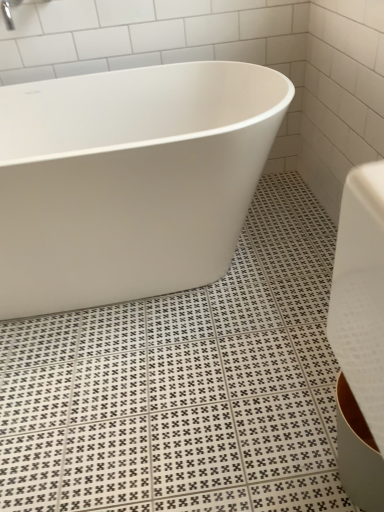
Question: Would you say white glossy bathtub at center contains silver metallic faucet at upper left?

Choices:
 (A) yes
 (B) no

Answer: (B)

Question: Can you confirm if white glossy bathtub at center is thinner than silver metallic faucet at upper left?

Choices:
 (A) no
 (B) yes

Answer: (A)

Question: Considering the relative sizes of white glossy bathtub at center and silver metallic faucet at upper left in the image provided, is white glossy bathtub at center taller than silver metallic faucet at upper left?

Choices:
 (A) no
 (B) yes

Answer: (B)

Question: From the image's perspective, is white glossy bathtub at center on silver metallic faucet at upper left?

Choices:
 (A) no
 (B) yes

Answer: (A)

Question: Does white glossy bathtub at center have a greater width compared to silver metallic faucet at upper left?

Choices:
 (A) no
 (B) yes

Answer: (B)

Question: Is white glossy bathtub at center in front of silver metallic faucet at upper left?

Choices:
 (A) yes
 (B) no

Answer: (A)

Question: From a real-world perspective, is silver metallic faucet at upper left under white glossy bathtub at center?

Choices:
 (A) no
 (B) yes

Answer: (A)

Question: Is silver metallic faucet at upper left looking in the opposite direction of white glossy bathtub at center?

Choices:
 (A) no
 (B) yes

Answer: (A)

Question: Is silver metallic faucet at upper left smaller than white glossy bathtub at center?

Choices:
 (A) no
 (B) yes

Answer: (B)

Question: Considering the relative positions of silver metallic faucet at upper left and white glossy bathtub at center in the image provided, is silver metallic faucet at upper left in front of white glossy bathtub at center?

Choices:
 (A) yes
 (B) no

Answer: (B)

Question: Is silver metallic faucet at upper left at the left side of white glossy bathtub at center?

Choices:
 (A) yes
 (B) no

Answer: (A)

Question: From the image's perspective, is silver metallic faucet at upper left under white glossy bathtub at center?

Choices:
 (A) yes
 (B) no

Answer: (B)

Question: From the image's perspective, is white glossy bathtub at center positioned above or below silver metallic faucet at upper left?

Choices:
 (A) below
 (B) above

Answer: (A)